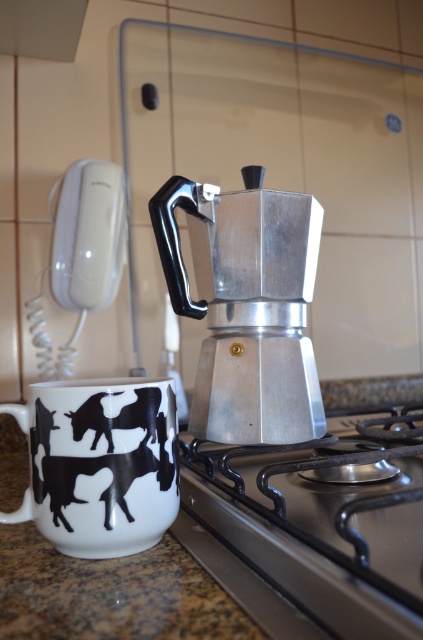
Is point (38, 470) positioned behind point (235, 611)?

Yes, point (38, 470) is behind point (235, 611).

In order to click on white matte mug at lower left in this screenshot , I will do `click(99, 464)`.

You are a GUI agent. You are given a task and a screenshot of the screen. Output one action in this format:
    pyautogui.click(x=<x>, y=<y>)
    Task: Click on the white matte mug at lower left
    Image resolution: width=423 pixels, height=640 pixels.
    Given the screenshot: What is the action you would take?
    pyautogui.click(x=99, y=464)

Does stainless steel gas stove at center have a greater width compared to silver metallic coffee maker at center?

Correct, the width of stainless steel gas stove at center exceeds that of silver metallic coffee maker at center.

Does point (279, 621) come in front of point (164, 205)?

Yes, point (279, 621) is closer to viewer.

Is point (198, 516) closer to camera compared to point (203, 285)?

Yes.

The height and width of the screenshot is (640, 423). In order to click on stainless steel gas stove at center in this screenshot , I will do `click(313, 536)`.

Is point (378, 419) closer to viewer compared to point (95, 396)?

No, it is behind (95, 396).

Which is below, stainless steel gas stove at center or white matte mug at lower left?

Positioned lower is stainless steel gas stove at center.

Is point (359, 532) more distant than point (137, 445)?

No, (359, 532) is in front of (137, 445).

Locate an element on the screen. The image size is (423, 640). stainless steel gas stove at center is located at coordinates (313, 536).